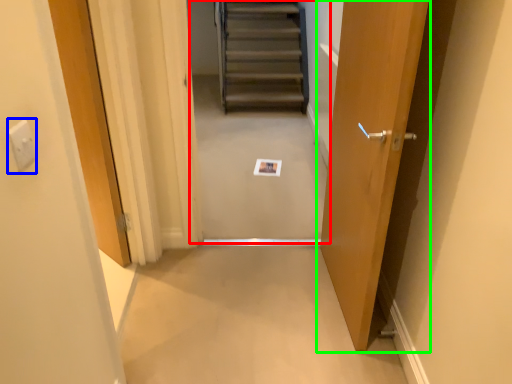
Question: Based on their relative distances, which object is farther from escalator (highlighted by a red box)? Choose from electric outlet (highlighted by a blue box) and door (highlighted by a green box).

Choices:
 (A) electric outlet
 (B) door

Answer: (A)